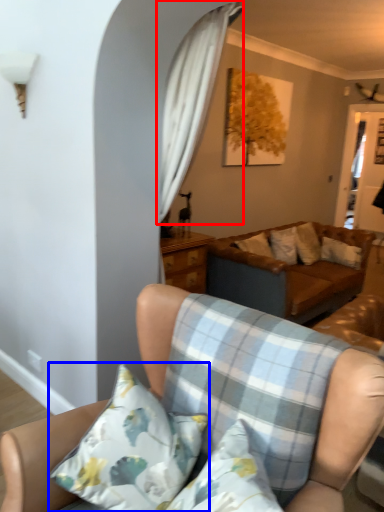
Question: Which of the following is the closest to the observer, curtain (highlighted by a red box) or pillow (highlighted by a blue box)?

Choices:
 (A) curtain
 (B) pillow

Answer: (B)